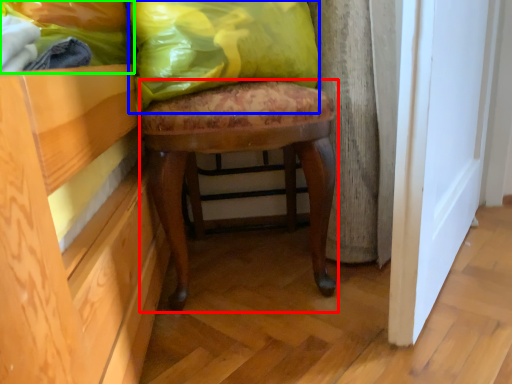
Question: Considering the real-world distances, which object is farthest from stool (highlighted by a red box)? throw pillow (highlighted by a blue box) or fabric (highlighted by a green box)?

Choices:
 (A) throw pillow
 (B) fabric

Answer: (B)